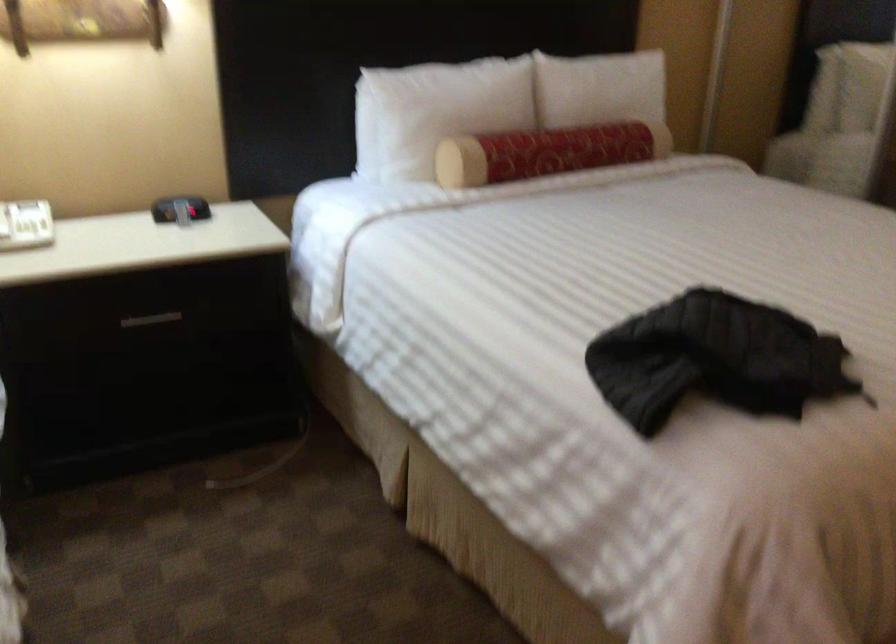
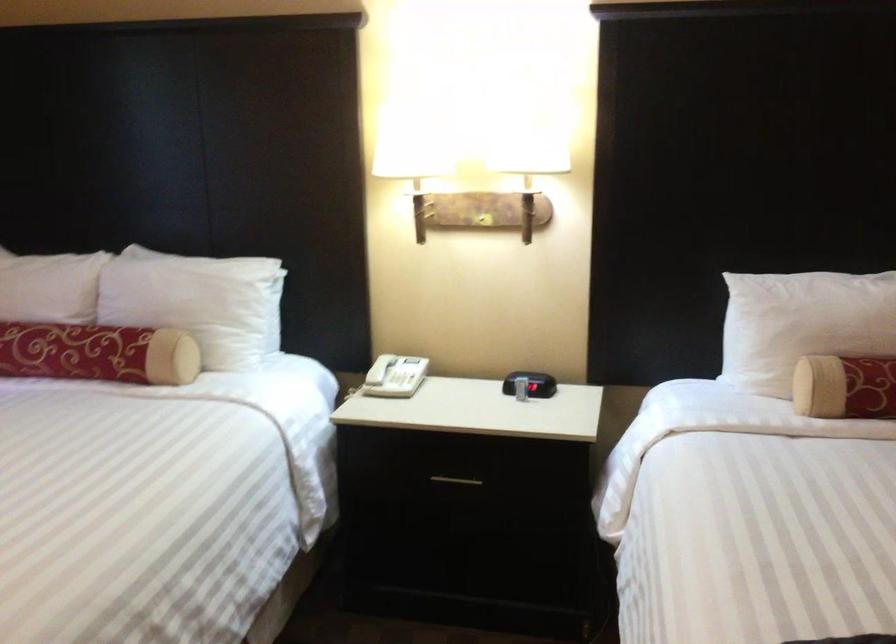
In the second image, find the point that corresponds to (x=441, y=115) in the first image.

(802, 324)